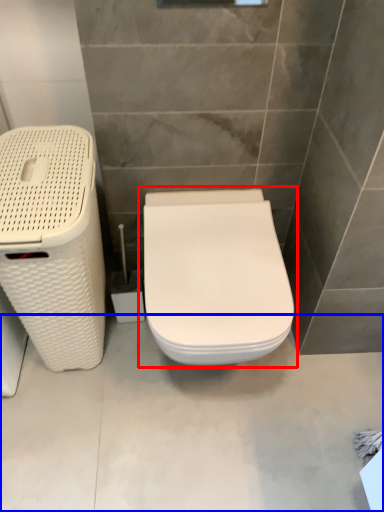
Question: Which point is closer to the camera, toilet (highlighted by a red box) or concrete (highlighted by a blue box)?

Choices:
 (A) toilet
 (B) concrete

Answer: (A)